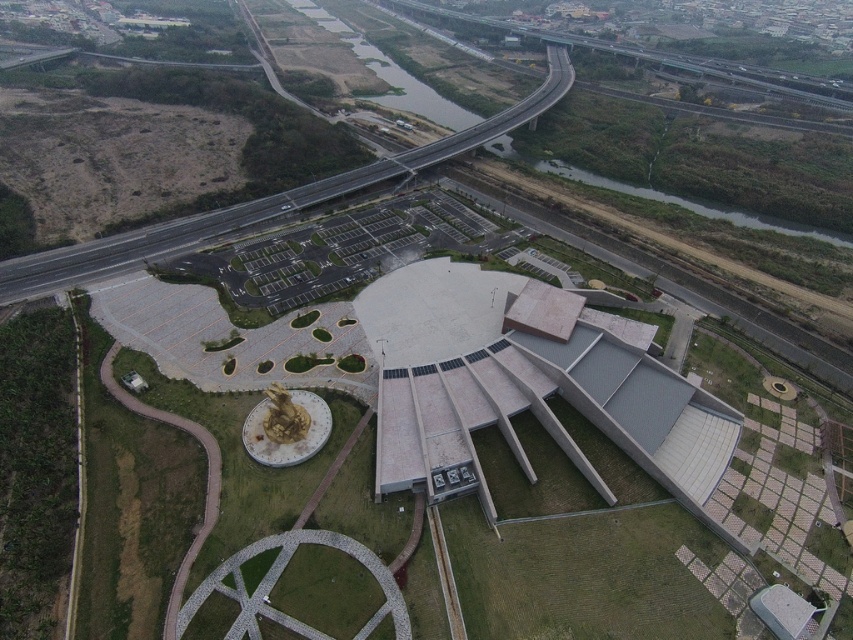
Question: Which point is farther to the camera?

Choices:
 (A) white concrete building at center
 (B) asphalt road at upper center

Answer: (B)

Question: Observing the image, what is the correct spatial positioning of white concrete building at center in reference to asphalt road at upper center?

Choices:
 (A) above
 (B) below

Answer: (B)

Question: Where is white concrete building at center located in relation to asphalt road at upper center in the image?

Choices:
 (A) below
 (B) above

Answer: (A)

Question: Does white concrete building at center lie in front of asphalt road at upper center?

Choices:
 (A) no
 (B) yes

Answer: (B)

Question: Among these points, which one is nearest to the camera?

Choices:
 (A) (235, 209)
 (B) (694, 497)

Answer: (B)